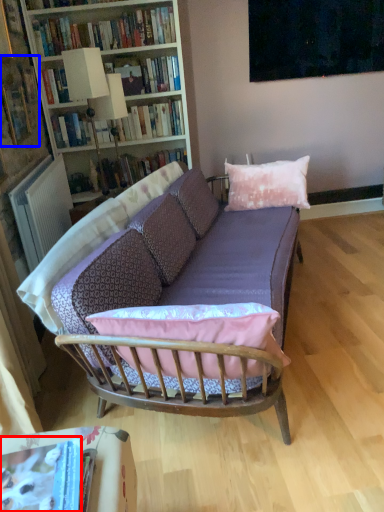
Question: Among these objects, which one is nearest to the camera, book (highlighted by a red box) or book (highlighted by a blue box)?

Choices:
 (A) book
 (B) book

Answer: (A)